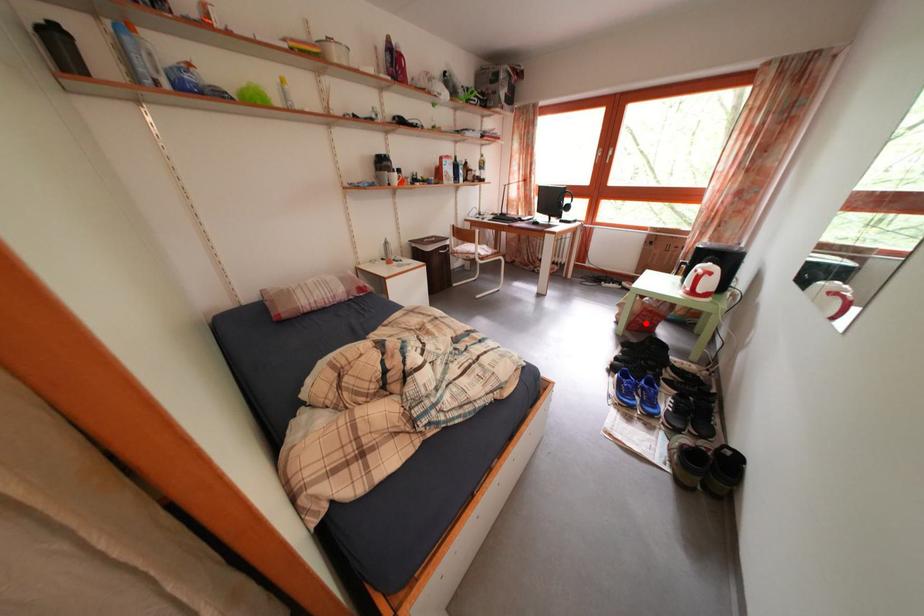
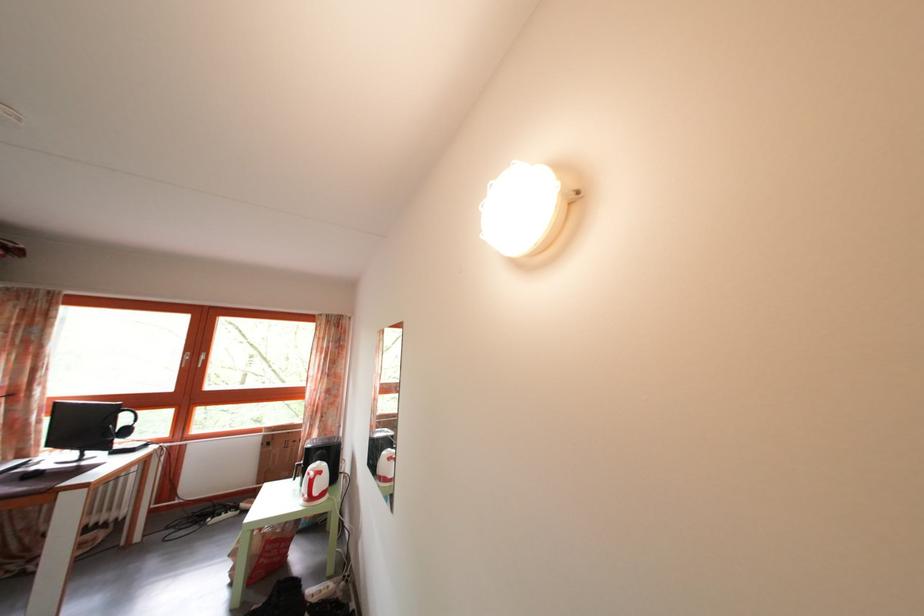
Question: I am providing you with two images of the same scene from different viewpoints. Given a red point in image1, look at the same physical point in image2. Is it:

Choices:
 (A) Closer to the viewpoint
 (B) Farther from the viewpoint

Answer: (B)